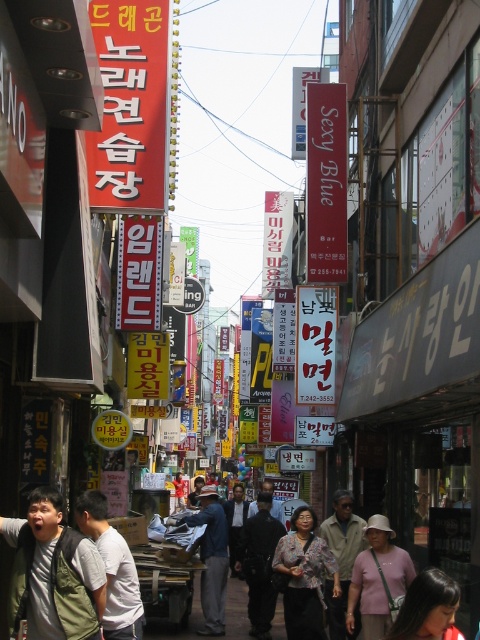
Question: Which point appears farthest from the camera in this image?

Choices:
 (A) (254, 554)
 (B) (71, 573)
 (C) (147, 179)

Answer: (A)

Question: Which of these objects is positioned closest to the pink fabric bag at center?

Choices:
 (A) dark blue jeans at center
 (B) white paper sign at center
 (C) smooth black hair at lower right
 (D) sexy blue sign at center

Answer: (C)

Question: Does green fabric vest at lower left appear on the right side of yellow matte sign at center?

Choices:
 (A) yes
 (B) no

Answer: (A)

Question: Is yellow matte sign at center below dark blue uniform at center?

Choices:
 (A) yes
 (B) no

Answer: (B)

Question: Is white paper sign at center wider than dark blue jeans at center?

Choices:
 (A) yes
 (B) no

Answer: (B)

Question: Which is farther from the floral fabric blouse at center?

Choices:
 (A) green fabric vest at lower left
 (B) white paper sign at center

Answer: (B)